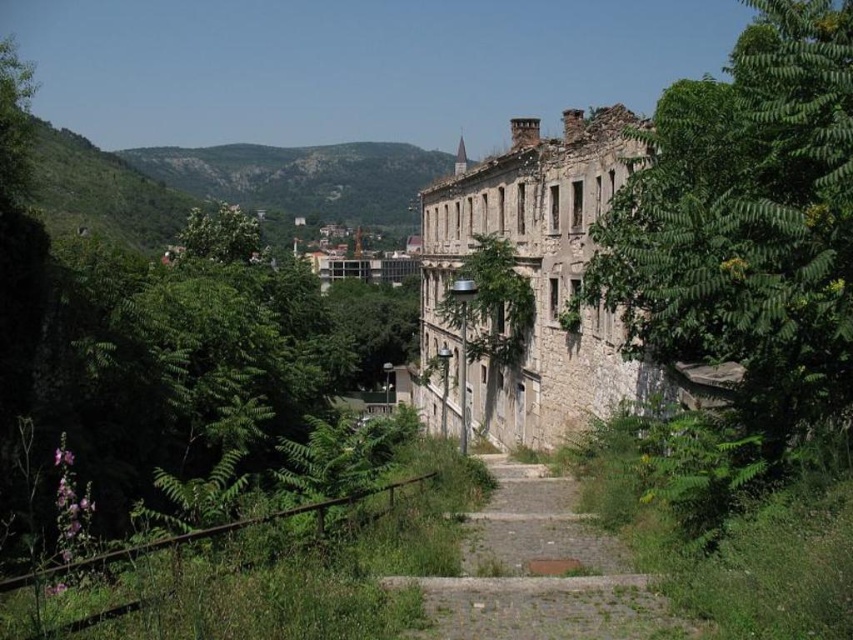
Question: Which object is closer to the camera taking this photo?

Choices:
 (A) green grassy hillside at upper center
 (B) dusty stone path at center
 (C) green leafy tree at right

Answer: (C)

Question: Which object appears farthest from the camera in this image?

Choices:
 (A) green grassy hillside at upper center
 (B) dusty stone path at center

Answer: (A)

Question: Which point appears closest to the camera in this image?

Choices:
 (A) (549, 524)
 (B) (254, 147)
 (C) (798, 378)

Answer: (C)

Question: Does green leafy tree at right appear over green grassy hillside at upper center?

Choices:
 (A) yes
 (B) no

Answer: (B)

Question: Can you confirm if dusty stone path at center is positioned to the right of green grassy hillside at upper center?

Choices:
 (A) no
 (B) yes

Answer: (B)

Question: Can you confirm if green leafy tree at right is bigger than dusty stone path at center?

Choices:
 (A) no
 (B) yes

Answer: (B)